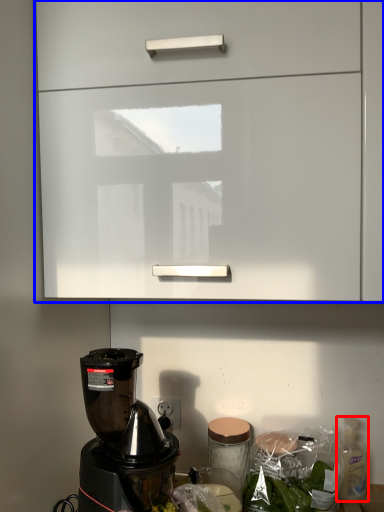
Question: Which object appears farthest to the camera in this image, bottle (highlighted by a red box) or cabinetry (highlighted by a blue box)?

Choices:
 (A) bottle
 (B) cabinetry

Answer: (A)